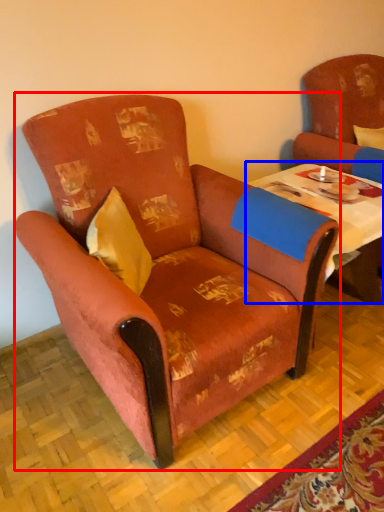
Question: Which object appears closest to the camera in this image, chair (highlighted by a red box) or table (highlighted by a blue box)?

Choices:
 (A) chair
 (B) table

Answer: (A)